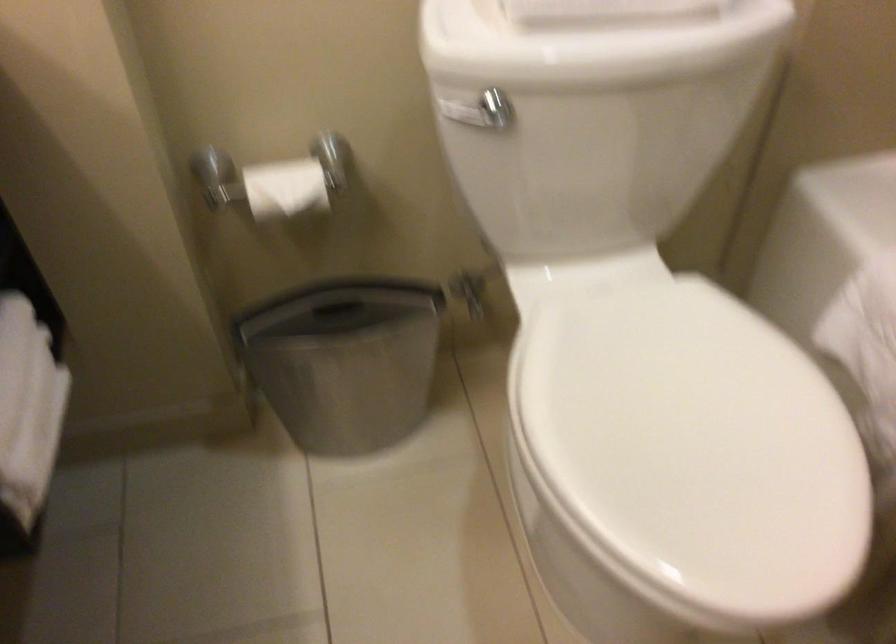
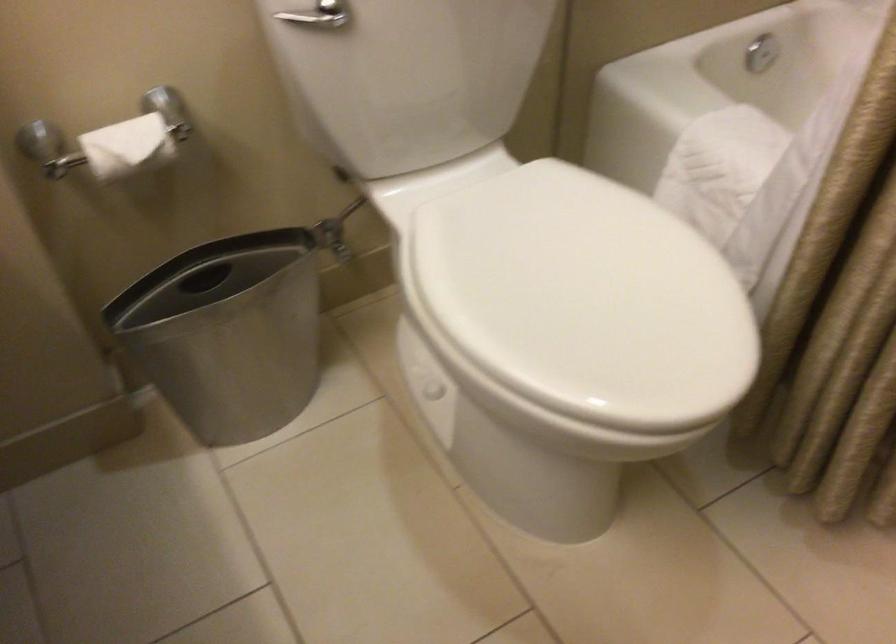
Find the pixel in the second image that matches pixel 262 187 in the first image.

(104, 152)